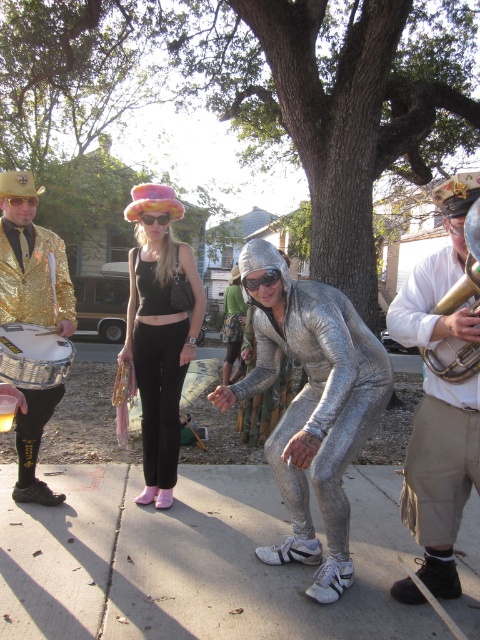
This screenshot has height=640, width=480. What do you see at coordinates (441, 474) in the screenshot?
I see `shiny silver suit at center` at bounding box center [441, 474].

Between point (424, 512) and point (152, 241), which one is positioned behind?

The point (152, 241) is more distant.

Is point (422, 438) positioned after point (152, 195)?

No.

In order to click on shiny silver suit at center in this screenshot , I will do `click(441, 474)`.

Does shiny metallic suit at center lie behind gold metallic jacket at left?

No, it is not.

Between shiny metallic suit at center and gold metallic jacket at left, which one appears on the left side from the viewer's perspective?

gold metallic jacket at left

Identify the location of shiny metallic suit at center. (312, 404).

Identify the location of shiny metallic suit at center. This screenshot has width=480, height=640. (312, 404).

Can you confirm if shiny silver suit at center is positioned below gold brass trumpet at upper right?

Yes.

Measure the distance from shiny silver suit at center to gold brass trumpet at upper right.

The distance of shiny silver suit at center from gold brass trumpet at upper right is 11.58 inches.

Image resolution: width=480 pixels, height=640 pixels. Describe the element at coordinates (441, 474) in the screenshot. I see `shiny silver suit at center` at that location.

At what (x,y) coordinates should I click in order to perform the action: click on shiny silver suit at center. Please return your answer as a coordinate pair (x, y). This screenshot has height=640, width=480. Looking at the image, I should click on (441, 474).